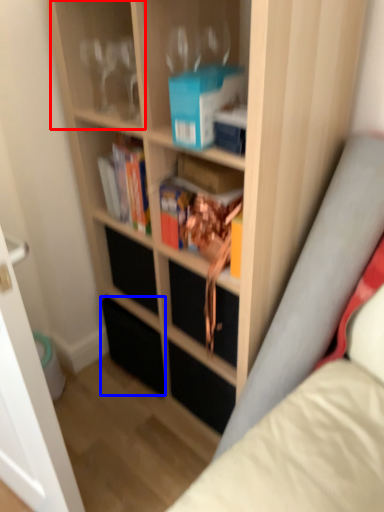
Question: Among these objects, which one is farthest to the camera, shelf (highlighted by a red box) or drawer (highlighted by a blue box)?

Choices:
 (A) shelf
 (B) drawer

Answer: (B)